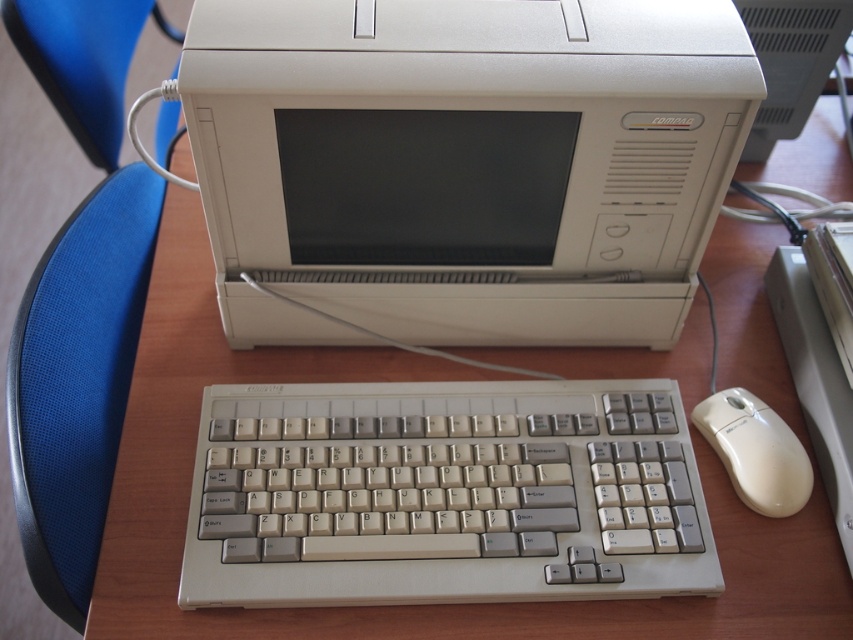
You are sitting in the blue fabric chair at left and want to reach the keyboard. Can you comfortably reach it from your current position?

The blue fabric chair at left is positioned at point [78,298], so yes, you can comfortably reach the keyboard from that position.

You are organizing a tech exhibition and need to stack a beige plastic monitor at center and a white plastic mouse at lower right vertically. Which one should be placed at the bottom to ensure stability?

The beige plastic monitor at center should be placed at the bottom because it has a greater height than the white plastic mouse at lower right, providing a stable base for the stack.

Where is the beige plastic monitor at center located in the image?

The beige plastic monitor at center is located at point (463, 163).